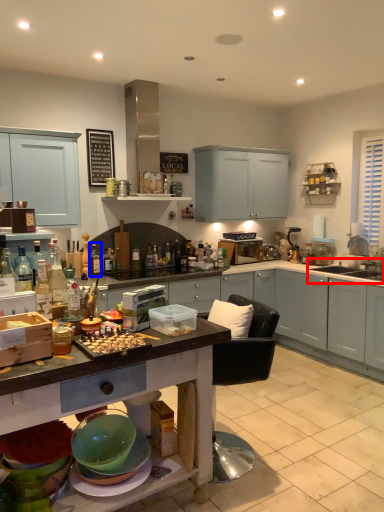
Question: Among these objects, which one is nearest to the camera, sink (highlighted by a red box) or bottle (highlighted by a blue box)?

Choices:
 (A) sink
 (B) bottle

Answer: (B)